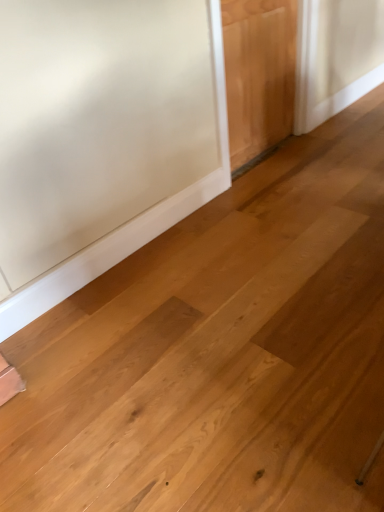
Locate an element on the screen. vacant space underneath light wood door at center (from a real-world perspective) is located at coordinates (269, 150).